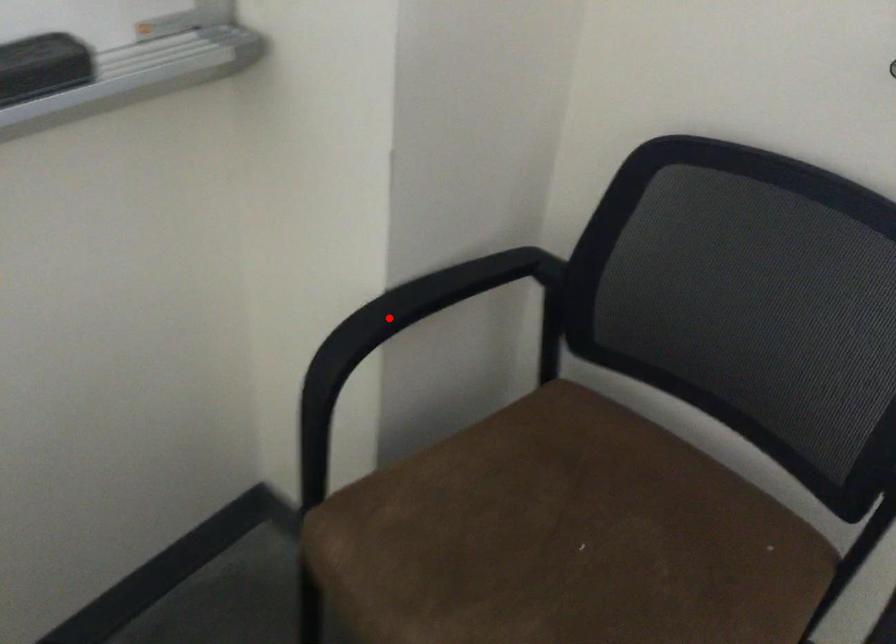
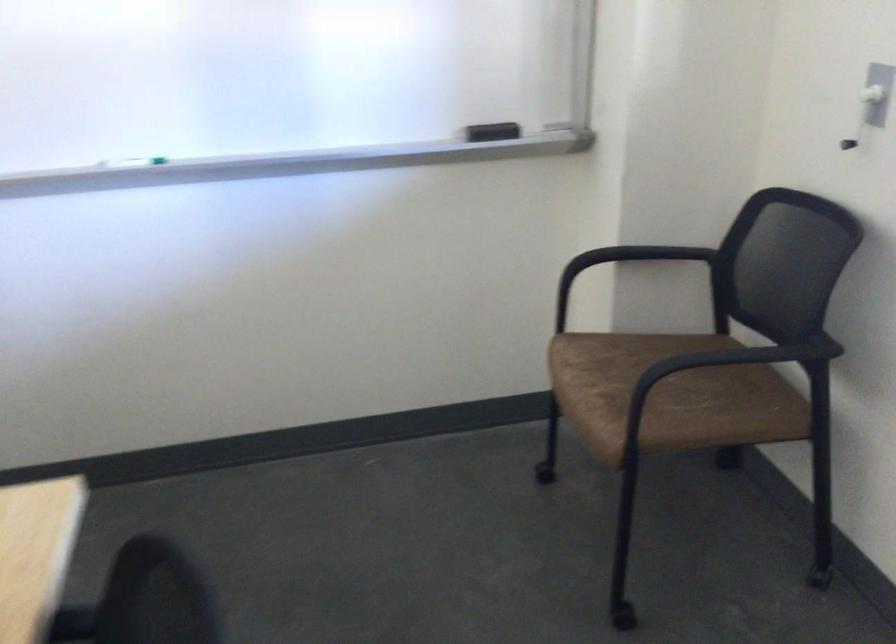
Locate, in the second image, the point that corresponds to the highlighted location in the first image.

(621, 263)